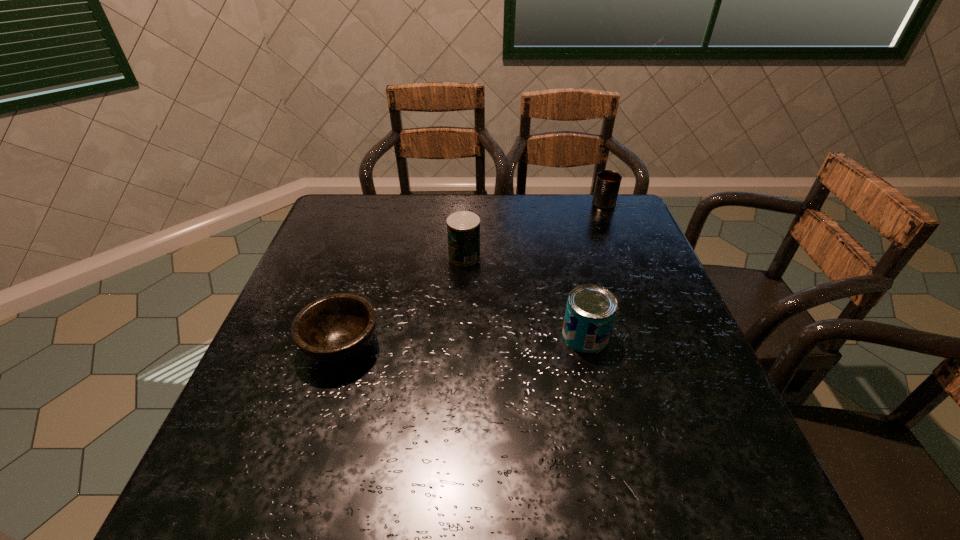
Identify the location of free region at the far left corner of the desktop. (320, 233).

At what (x,y) coordinates should I click in order to perform the action: click on vacant space at the near left corner of the desktop. Please return your answer as a coordinate pair (x, y). The image size is (960, 540). Looking at the image, I should click on (214, 473).

The image size is (960, 540). What are the coordinates of `vacant area at the near right corner of the desktop` in the screenshot? It's located at (685, 505).

Where is `empty location between the third object from left to right and the rightmost object`? empty location between the third object from left to right and the rightmost object is located at coordinates (594, 269).

Locate an element on the screen. This screenshot has height=540, width=960. free space between the leftmost object and the farthest object is located at coordinates (472, 275).

Where is `empty space that is in between the bowl and the farthest can`? This screenshot has width=960, height=540. empty space that is in between the bowl and the farthest can is located at coordinates (472, 275).

Where is `free space that is in between the second farthest can and the rightmost can`? This screenshot has width=960, height=540. free space that is in between the second farthest can and the rightmost can is located at coordinates (534, 230).

Identify the location of empty location between the farthest can and the third nearest object. (534, 230).

What are the coordinates of `free space between the nearest can and the farthest object` in the screenshot? It's located at (594, 269).

Where is `vacant point located between the third nearest object and the rightmost can`? The height and width of the screenshot is (540, 960). vacant point located between the third nearest object and the rightmost can is located at coordinates (534, 230).